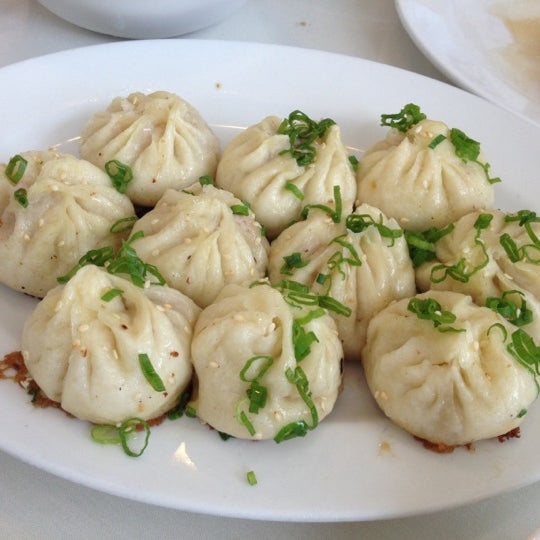
Find the location of a particular element. This screenshot has width=540, height=540. bowl is located at coordinates (164, 10).